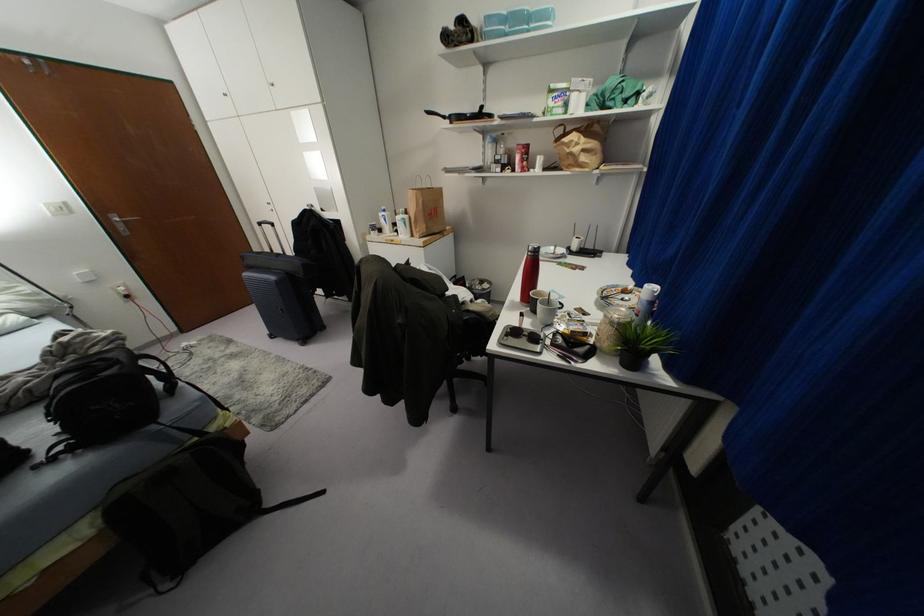
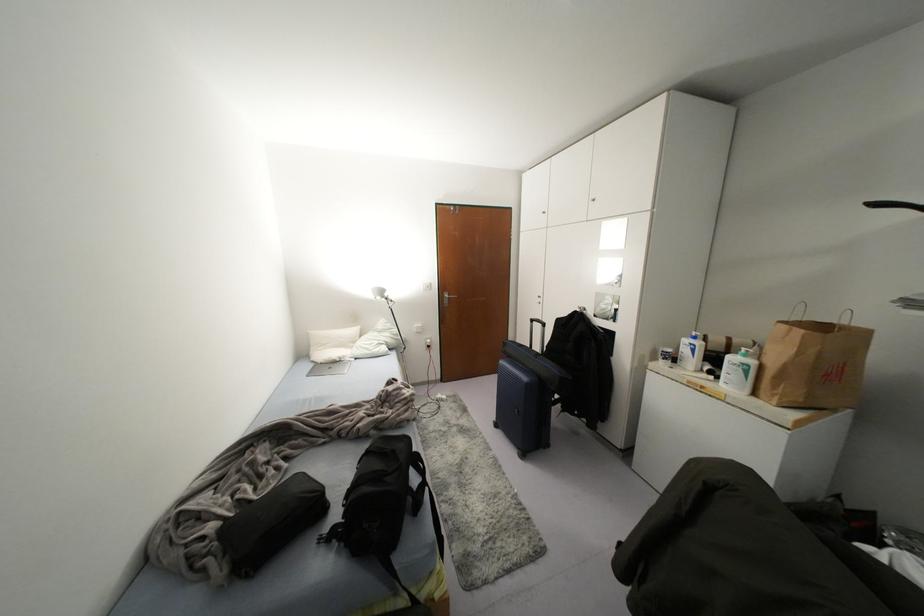
The point at (405,216) is marked in the first image. Where is the corresponding point in the second image?

(751, 362)